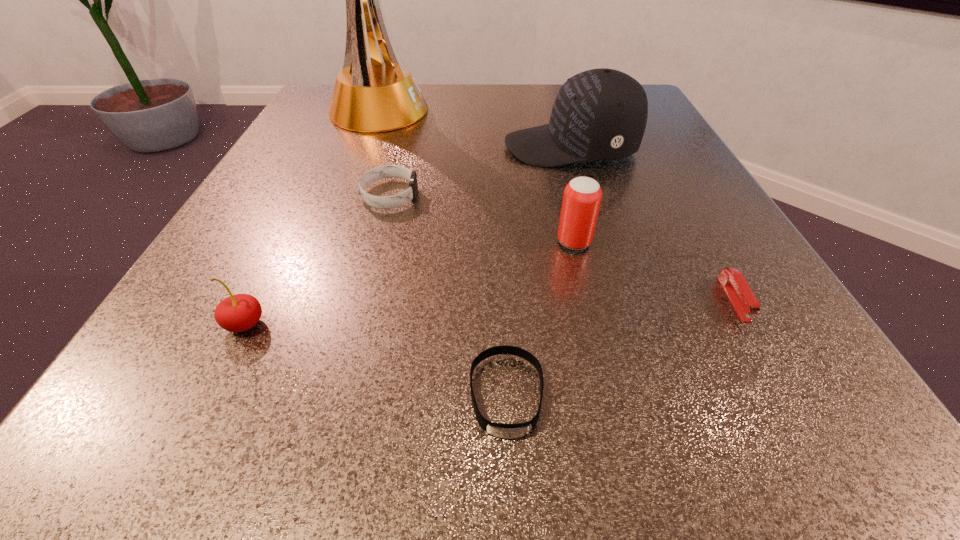
Identify the location of object at the near edge. (509, 431).

Find the location of `trophy that is positioned at the left edge`. trophy that is positioned at the left edge is located at coordinates (381, 95).

The height and width of the screenshot is (540, 960). What are the coordinates of `cherry that is at the left edge` in the screenshot? It's located at (237, 313).

Find the location of a particular element. The image size is (960, 540). baseball cap present at the right edge is located at coordinates (600, 114).

This screenshot has width=960, height=540. In order to click on stapler that is at the right edge in this screenshot , I will do `click(742, 298)`.

I want to click on object present at the far left corner, so click(381, 95).

Identify the location of object located at the far right corner. This screenshot has width=960, height=540. (600, 114).

In the image, there is a desktop. What are the coordinates of `vacant space at the far edge` in the screenshot? It's located at (496, 116).

Identify the location of free space at the near edge. (477, 383).

Where is `blank space at the left edge of the desktop`? Image resolution: width=960 pixels, height=540 pixels. blank space at the left edge of the desktop is located at coordinates (300, 139).